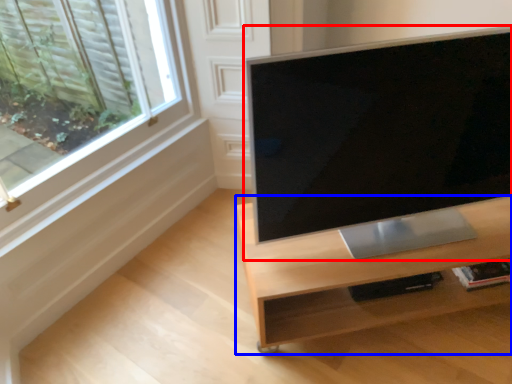
Question: Which object appears closest to the camera in this image, computer monitor (highlighted by a red box) or desk (highlighted by a blue box)?

Choices:
 (A) computer monitor
 (B) desk

Answer: (A)